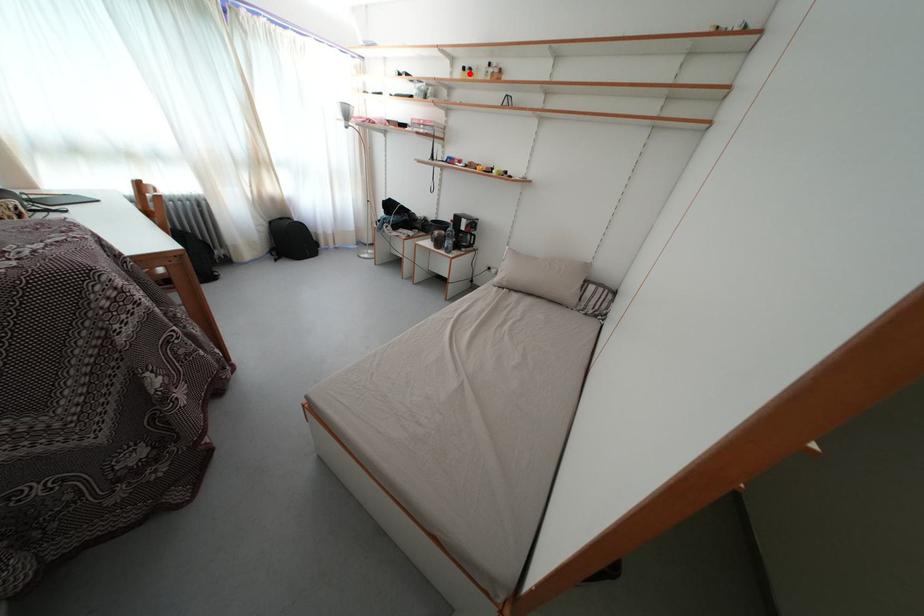
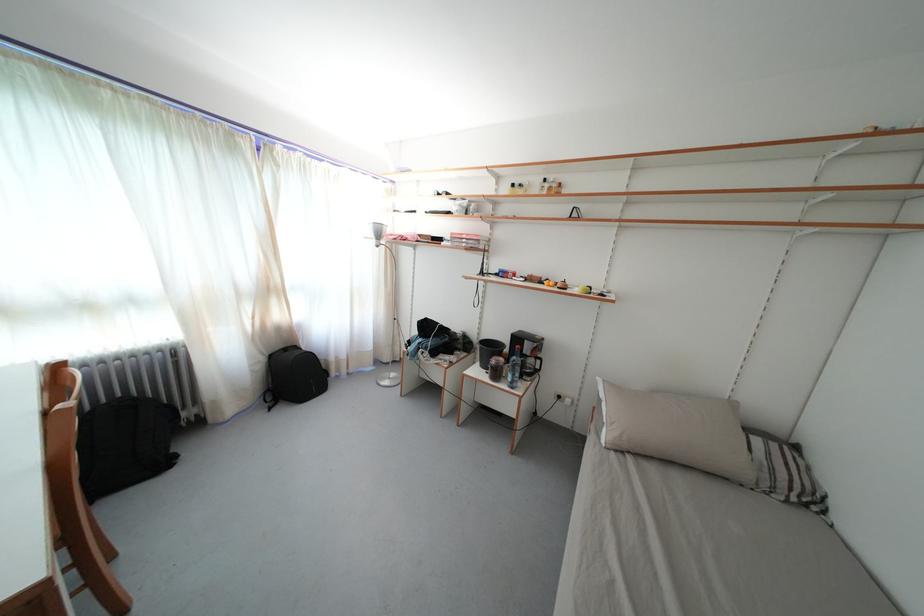
Question: I am providing you with two images of the same scene from different viewpoints. A red point is marked on the first image. Is the red point's position out of view in image 2?

Choices:
 (A) Yes
 (B) No

Answer: (B)